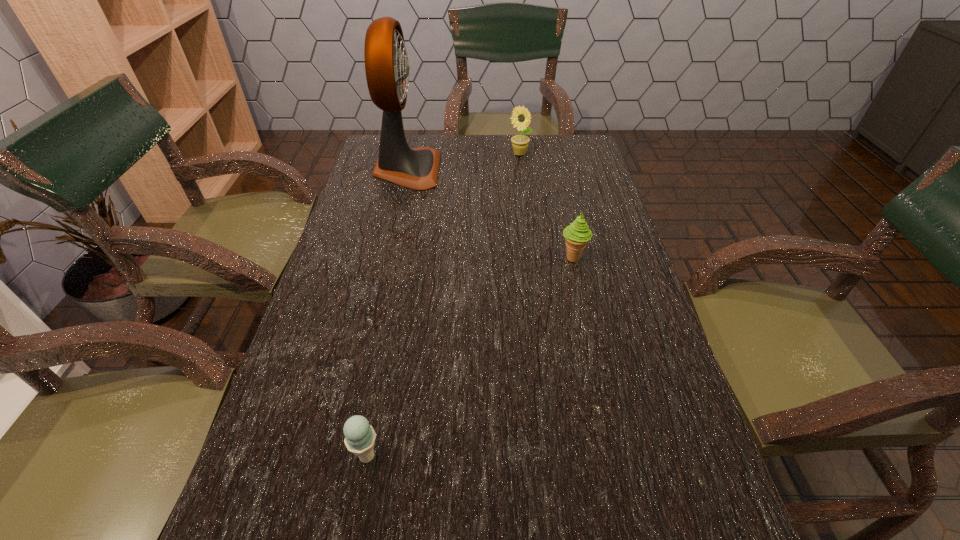
Image resolution: width=960 pixels, height=540 pixels. Identify the location of the tallest object. (387, 67).

Identify the location of the third object from left to right. This screenshot has width=960, height=540. (519, 142).

This screenshot has width=960, height=540. I want to click on sunflower, so click(519, 142).

Find the location of a particular element. the second shortest object is located at coordinates (577, 234).

Locate an element on the screen. The width and height of the screenshot is (960, 540). the right ice cream is located at coordinates (577, 234).

Identify the location of the nearest object. This screenshot has height=540, width=960. (360, 437).

Find the location of a particular element. The width and height of the screenshot is (960, 540). the nearer ice cream is located at coordinates (360, 437).

The image size is (960, 540). Find the location of `free space located 0.270m on the front-facing side of the tallest object`. free space located 0.270m on the front-facing side of the tallest object is located at coordinates (522, 170).

Where is `vacant space located on the face of the second object from right to left`? The image size is (960, 540). vacant space located on the face of the second object from right to left is located at coordinates (524, 192).

The image size is (960, 540). I want to click on vacant space positioned 0.120m on the left of the rightmost object, so click(x=512, y=258).